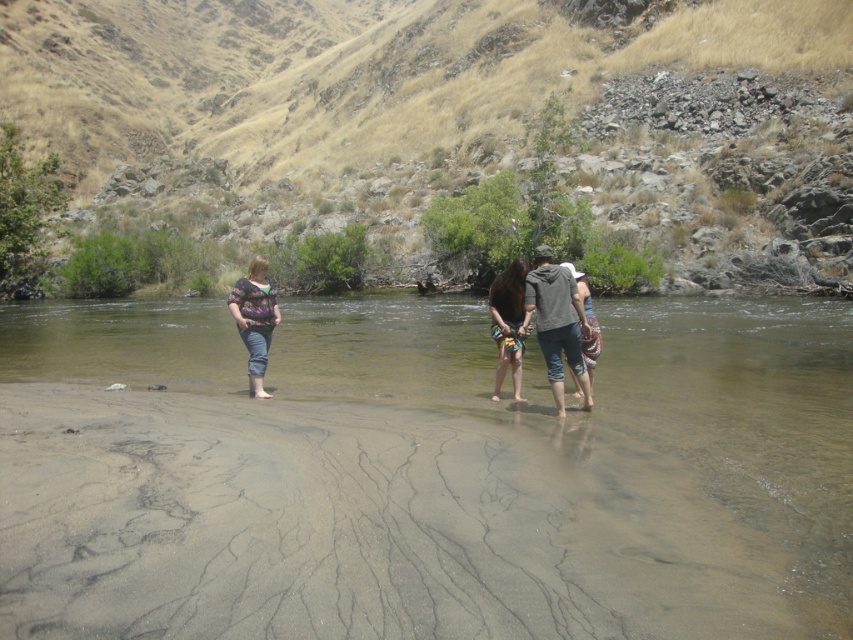
You are standing at the point with coordinates point (544,346) and want to reach the point with coordinates point (144,557). Which direction should you move in to get there?

You should move forward because point (144,557) is in front of point (544,346).

You are planning to take a photo of the two people in the river. The camera you have can only focus on objects within a 5 meter range. Given their positions, will both the matte floral shirt at center and the multicolored fabric dress at center be in focus?

The matte floral shirt at center and the multicolored fabric dress at center are 9.27 meters apart from each other. Since the camera can only focus within a 5 meter range, the distance between them exceeds this limit, so both cannot be in focus simultaneously.